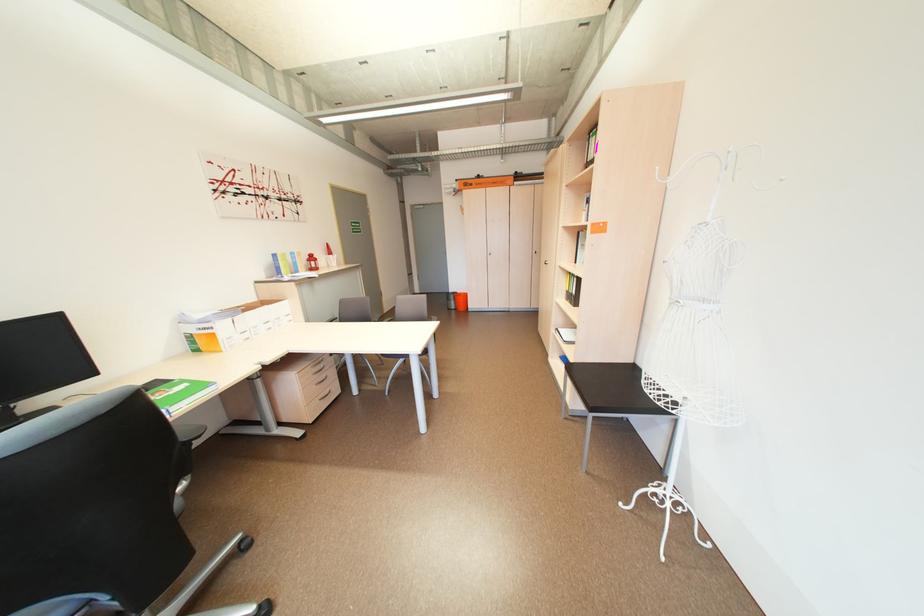
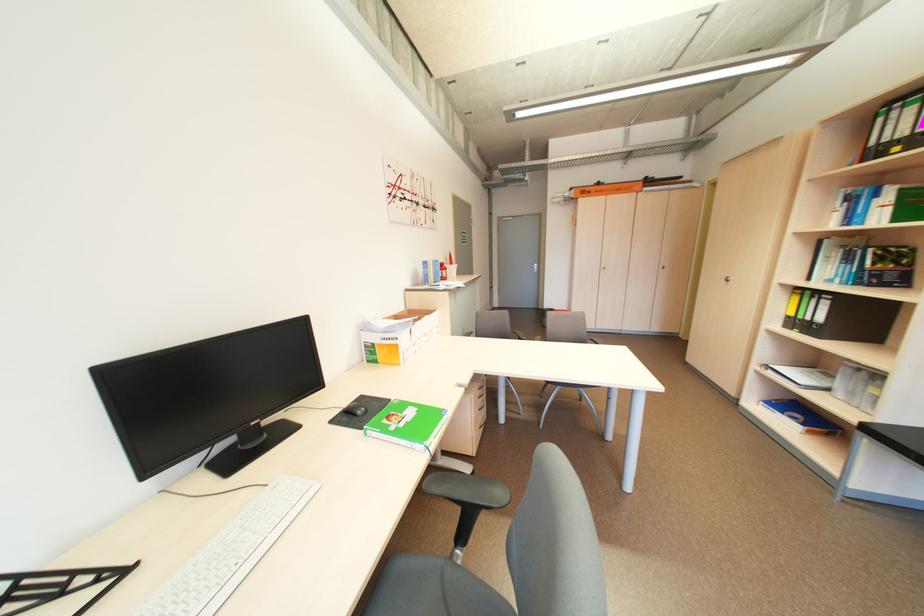
Locate, in the second image, the point that corresponds to pixel 223 334 in the first image.

(406, 347)